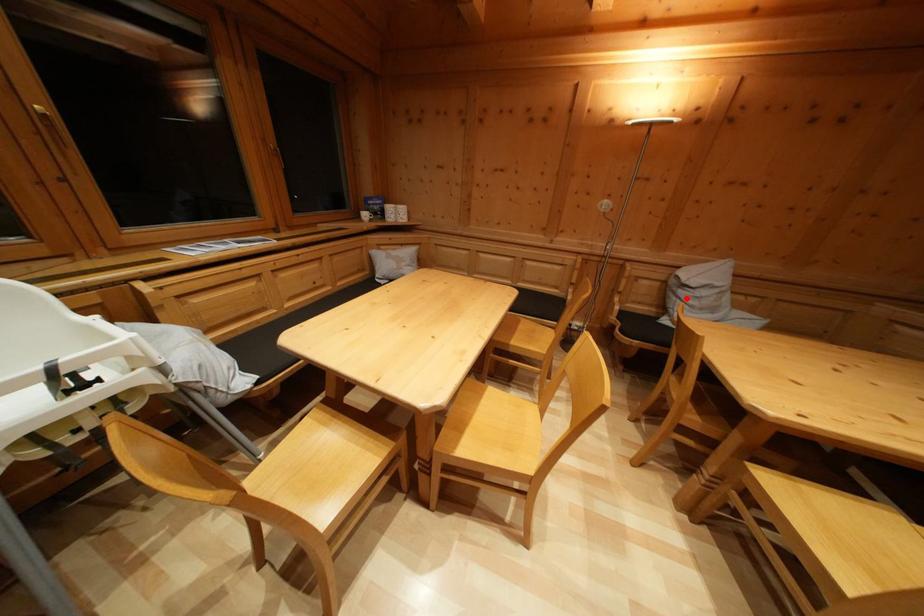
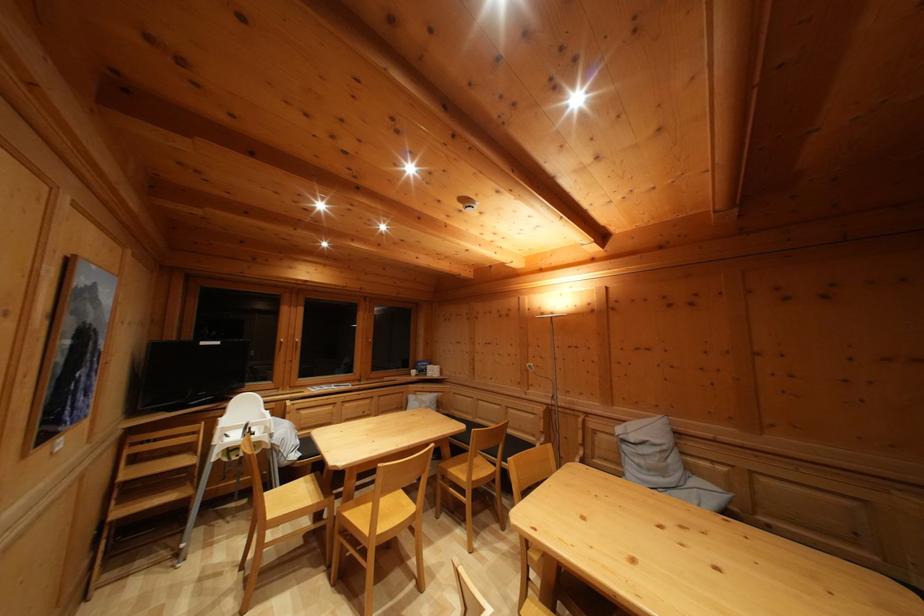
Question: I am providing you with two images of the same scene from different viewpoints. Image1 has a red point marked. In image2, the corresponding 3D location appears at what relative position? Reply with the corresponding letter.

Choices:
 (A) Closer
 (B) Farther

Answer: (B)